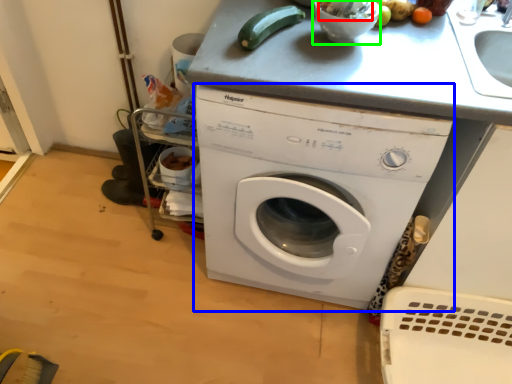
Question: Which object is the farthest from food (highlighted by a red box)? Choose among these: washing machine (highlighted by a blue box) or mixing bowl (highlighted by a green box).

Choices:
 (A) washing machine
 (B) mixing bowl

Answer: (A)